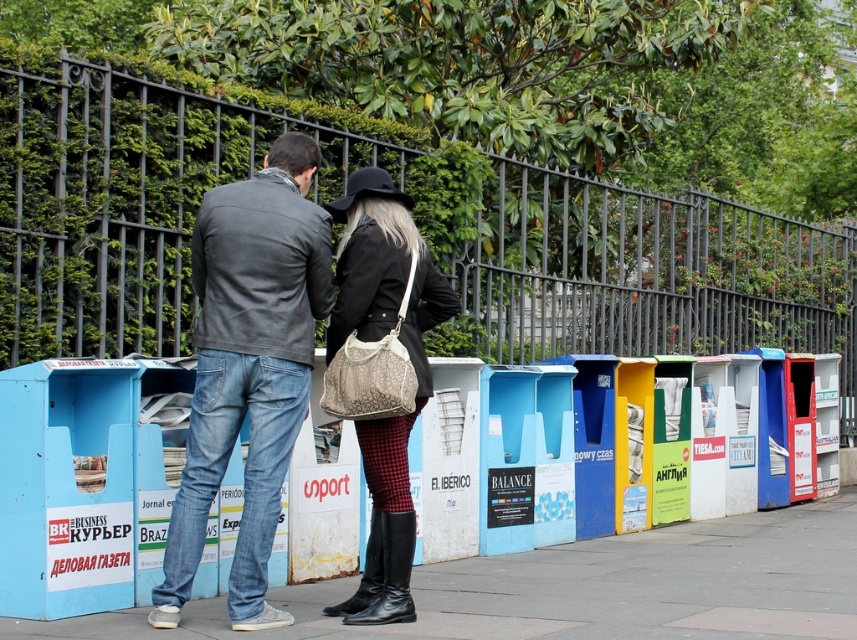
Is black metal fence at upper center further to the viewer compared to denim jeans at center?

Yes, it is behind denim jeans at center.

Between point (141, 333) and point (291, 346), which one is positioned behind?

Point (141, 333)

This screenshot has height=640, width=857. Identify the location of black metal fence at upper center. (415, 220).

Is point (87, 243) more distant than point (390, 586)?

Yes, point (87, 243) is farther from viewer.

Consider the image. Does black metal fence at upper center have a larger size compared to matte black coat at center?

Indeed, black metal fence at upper center has a larger size compared to matte black coat at center.

Between point (235, 97) and point (421, 304), which one is positioned behind?

Point (235, 97)

Where is `black metal fence at upper center`? The height and width of the screenshot is (640, 857). black metal fence at upper center is located at coordinates (415, 220).

Which is below, denim jeans at center or matte black coat at center?

matte black coat at center

Between point (208, 433) and point (340, 246), which one is positioned behind?

Positioned behind is point (340, 246).

In order to click on denim jeans at center in this screenshot , I will do `click(249, 368)`.